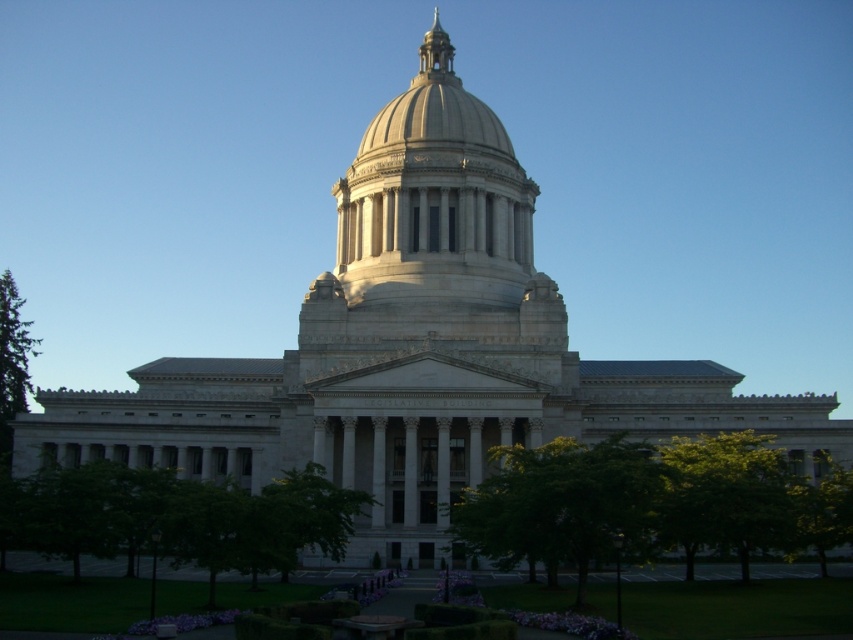
You are a GUI agent. You are given a task and a screenshot of the screen. Output one action in this format:
    pyautogui.click(x=<x>, y=<y>)
    Task: Click on the green leafy tree at lower left
    This screenshot has width=853, height=640.
    Given the screenshot: What is the action you would take?
    pyautogui.click(x=177, y=518)

Who is more distant from viewer, (16, 522) or (608, 550)?

The point (16, 522) is behind.

Who is more distant from viewer, [207,529] or [547,531]?

The point [207,529] is more distant.

The height and width of the screenshot is (640, 853). What are the coordinates of `green leafy tree at lower left` in the screenshot? It's located at (177, 518).